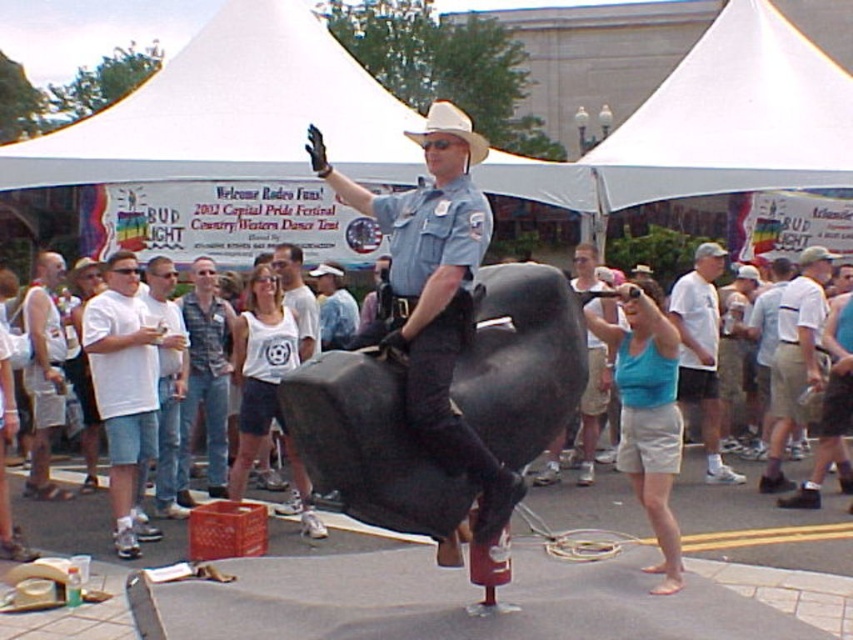
Question: Which of the following is the farthest from the observer?

Choices:
 (A) light blue uniform at center
 (B) denim shirt at center
 (C) white cotton t-shirt at left

Answer: (B)

Question: Is white cotton t-shirt at left closer to camera compared to denim shirt at center?

Choices:
 (A) yes
 (B) no

Answer: (A)

Question: Which point is closer to the camera?

Choices:
 (A) blue cotton tank top at center
 (B) light blue uniform at center
 (C) white cotton shirt at center

Answer: (B)

Question: In this image, where is white cotton t-shirt at left located relative to blue cotton tank top at center?

Choices:
 (A) above
 (B) below

Answer: (A)

Question: Which object is the closest to the light blue uniform at center?

Choices:
 (A) white cotton shirt at center
 (B) white cotton tank top at center
 (C) denim shirt at center
 (D) white cotton t-shirt at left

Answer: (B)

Question: Is white cotton t-shirt at left thinner than white cotton t-shirt at center?

Choices:
 (A) no
 (B) yes

Answer: (B)